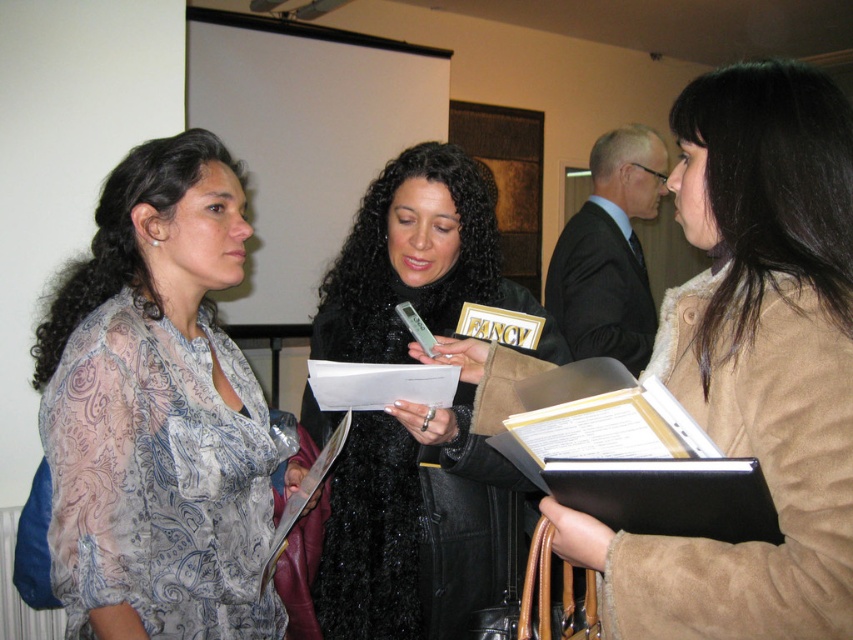
You are an event organizer who needs to arrange seating for attendees. You observe the suede beige coat at right and the black fuzzy coat at center. Which coat is positioned closer to the front of the room?

The suede beige coat at right is closer to the viewer than the black fuzzy coat at center, so the suede beige coat at right is positioned closer to the front of the room.

You are standing in a room where a presentation is taking place. There is a point at coordinates (120, 369). Can you estimate how far this point is from your current position?

The point at coordinates (120, 369) is 1.13 meters away from your current position.